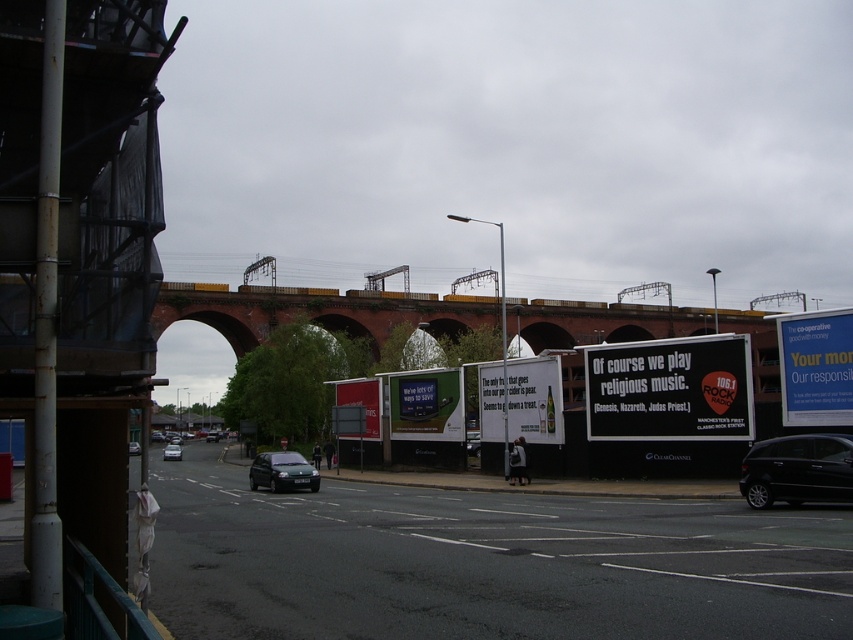
Is black matte billboard at center taller than dark green matte hatchback at center?

In fact, black matte billboard at center may be shorter than dark green matte hatchback at center.

Does black matte billboard at center appear on the left side of dark green matte hatchback at center?

No, black matte billboard at center is not to the left of dark green matte hatchback at center.

Between point (619, 364) and point (283, 480), which one is positioned behind?

Point (619, 364)

Find the location of a particular element. Image resolution: width=853 pixels, height=640 pixels. black matte billboard at center is located at coordinates (x=670, y=388).

Can you confirm if brick arch bridge at center is thinner than silver metallic sedan at center?

No, brick arch bridge at center is not thinner than silver metallic sedan at center.

Can you confirm if brick arch bridge at center is smaller than silver metallic sedan at center?

Incorrect, brick arch bridge at center is not smaller in size than silver metallic sedan at center.

Where is `brick arch bridge at center`? The height and width of the screenshot is (640, 853). brick arch bridge at center is located at coordinates (312, 310).

Is shiny black car at lower right closer to camera compared to white glossy billboard at center?

That is True.

What do you see at coordinates (798, 468) in the screenshot?
I see `shiny black car at lower right` at bounding box center [798, 468].

Image resolution: width=853 pixels, height=640 pixels. I want to click on shiny black car at lower right, so click(798, 468).